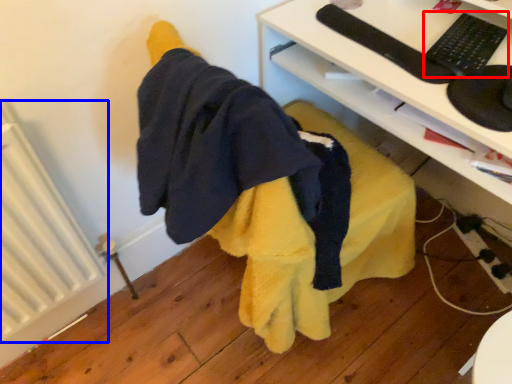
Question: Which object appears closest to the camera in this image, keyboard (highlighted by a red box) or radiator (highlighted by a blue box)?

Choices:
 (A) keyboard
 (B) radiator

Answer: (B)